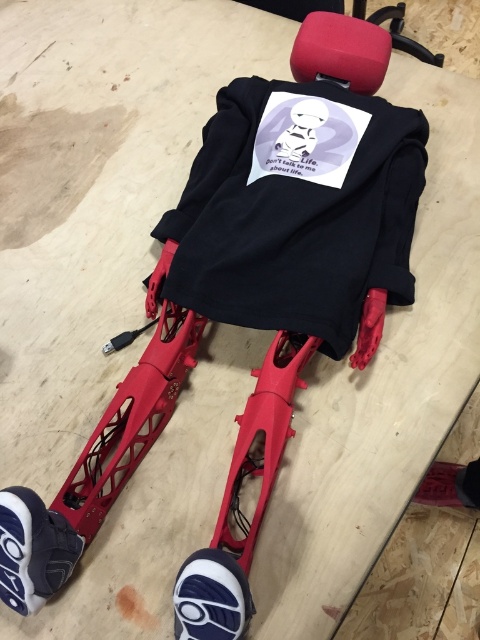
Which is more to the right, white textured shoe at lower left or white rubber shoe at lower left?

From the viewer's perspective, white rubber shoe at lower left appears more on the right side.

Is white textured shoe at lower left bigger than white rubber shoe at lower left?

Incorrect, white textured shoe at lower left is not larger than white rubber shoe at lower left.

Is point (8, 529) positioned in front of point (191, 557)?

Yes.

Find the location of `white textured shoe at lower left`. white textured shoe at lower left is located at coordinates (33, 548).

In the scene shown: Can you confirm if black matte sweatshirt at center is positioned to the right of white rubber shoe at lower left?

Yes, black matte sweatshirt at center is to the right of white rubber shoe at lower left.

Can you confirm if black matte sweatshirt at center is smaller than white rubber shoe at lower left?

No, black matte sweatshirt at center is not smaller than white rubber shoe at lower left.

Which is in front, point (342, 336) or point (199, 561)?

Point (199, 561) is more forward.

Locate an element on the screen. black matte sweatshirt at center is located at coordinates (298, 209).

Can you confirm if black matte sweatshirt at center is smaller than dark gray rubber shoe at lower left?

Incorrect, black matte sweatshirt at center is not smaller in size than dark gray rubber shoe at lower left.

Can you confirm if black matte sweatshirt at center is positioned to the left of dark gray rubber shoe at lower left?

Indeed, black matte sweatshirt at center is positioned on the left side of dark gray rubber shoe at lower left.

Describe the element at coordinates (298, 209) in the screenshot. This screenshot has height=640, width=480. I see `black matte sweatshirt at center` at that location.

Find the location of a particular element. This screenshot has width=480, height=640. black matte sweatshirt at center is located at coordinates (298, 209).